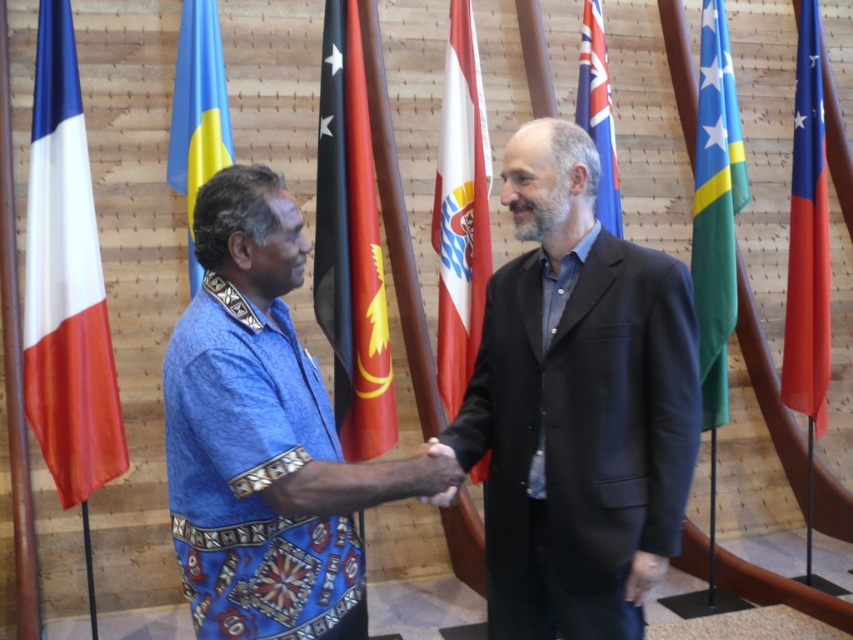
Question: Does white/red/striped flag at center have a smaller size compared to green fabric flag at right?

Choices:
 (A) no
 (B) yes

Answer: (B)

Question: Which point is closer to the camera taking this photo?

Choices:
 (A) (183, 100)
 (B) (366, 150)
 (C) (793, 157)
 (D) (258, 211)

Answer: (D)

Question: Can you confirm if dark blue suit at center is positioned below white/red/striped flag at center?

Choices:
 (A) no
 (B) yes

Answer: (B)

Question: Among these objects, which one is farthest from the camera?

Choices:
 (A) red fabric flag at right
 (B) white/red/striped flag at center
 (C) green fabric flag at right
 (D) red fabric flag at center

Answer: (A)

Question: Which of these objects is positioned closest to the dark blue suit at center?

Choices:
 (A) blue woven shirt at center
 (B) blue fabric flag at left
 (C) matte black hand at center
 (D) blue fabric flag at center

Answer: (C)

Question: Is the position of green fabric flag at right more distant than that of matte black hand at center?

Choices:
 (A) no
 (B) yes

Answer: (B)